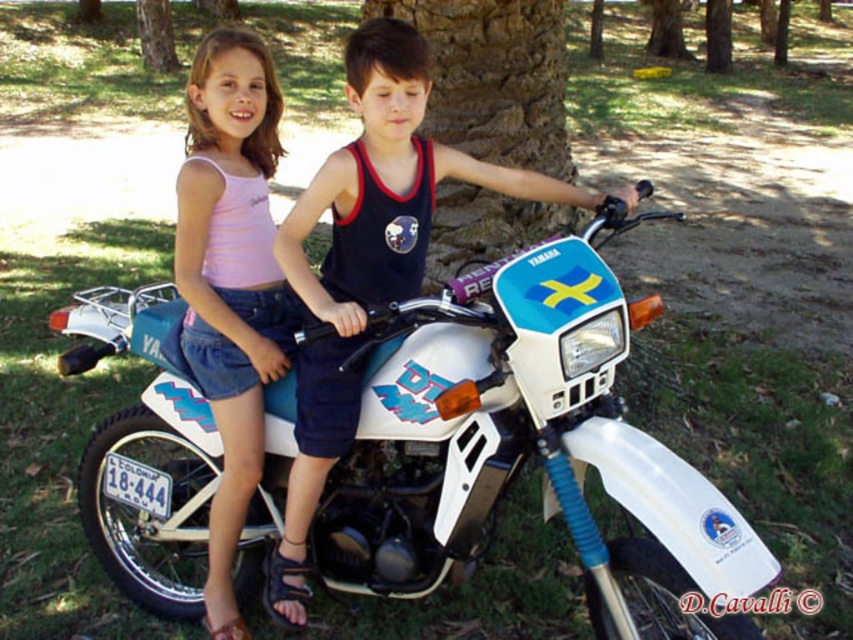
Which is more to the right, brown textured tree trunk at center or brown textured tree trunk at upper center?

brown textured tree trunk at upper center

Does brown textured tree trunk at center appear under brown textured tree trunk at upper center?

Yes, brown textured tree trunk at center is below brown textured tree trunk at upper center.

This screenshot has height=640, width=853. What do you see at coordinates (494, 77) in the screenshot?
I see `brown textured tree trunk at center` at bounding box center [494, 77].

At what (x,y) coordinates should I click in order to perform the action: click on brown textured tree trunk at center. Please return your answer as a coordinate pair (x, y). Looking at the image, I should click on (494, 77).

Measure the distance between white plastic motorcycle at center and brown textured tree trunk at upper center.

white plastic motorcycle at center is 26.25 meters away from brown textured tree trunk at upper center.

Can you confirm if white plastic motorcycle at center is wider than brown textured tree trunk at upper center?

Yes, white plastic motorcycle at center is wider than brown textured tree trunk at upper center.

At what (x,y) coordinates should I click in order to perform the action: click on white plastic motorcycle at center. Please return your answer as a coordinate pair (x, y). This screenshot has height=640, width=853. Looking at the image, I should click on (526, 445).

Locate an element on the screen. white plastic motorcycle at center is located at coordinates (526, 445).

Who is taller, pink striped tank top at upper left or brown textured tree trunk at center?

With more height is pink striped tank top at upper left.

Is point (183, 177) positioned in front of point (524, 145)?

Yes, point (183, 177) is in front of point (524, 145).

Who is more distant from viewer, (221,182) or (558,36)?

The point (558,36) is behind.

You are a GUI agent. You are given a task and a screenshot of the screen. Output one action in this format:
    pyautogui.click(x=<x>, y=<y>)
    Task: Click on the pink striped tank top at upper left
    
    Given the screenshot: What is the action you would take?
    pyautogui.click(x=230, y=280)